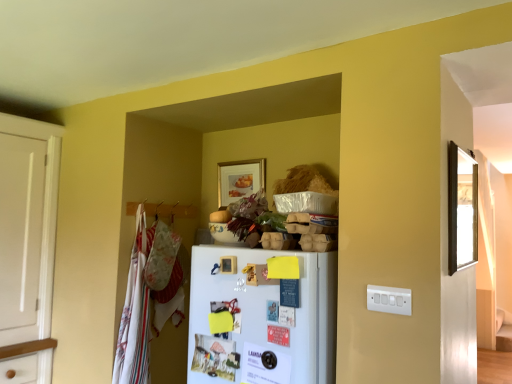
Question: From a real-world perspective, is white matte refrigerator at center physically above white cotton laundry at left?

Choices:
 (A) no
 (B) yes

Answer: (A)

Question: Would you say white matte refrigerator at center is outside white cotton laundry at left?

Choices:
 (A) yes
 (B) no

Answer: (A)

Question: Does white matte refrigerator at center come behind white cotton laundry at left?

Choices:
 (A) yes
 (B) no

Answer: (B)

Question: Can you confirm if white matte refrigerator at center is smaller than white cotton laundry at left?

Choices:
 (A) yes
 (B) no

Answer: (A)

Question: Can you confirm if white matte refrigerator at center is bigger than white cotton laundry at left?

Choices:
 (A) no
 (B) yes

Answer: (A)

Question: From the image's perspective, is white cotton laundry at left above or below wooden mirror at right, placed as the first picture frame when sorted from front to back?

Choices:
 (A) above
 (B) below

Answer: (B)

Question: From a real-world perspective, is white cotton laundry at left above or below wooden mirror at right, the 1th picture frame viewed from the right?

Choices:
 (A) above
 (B) below

Answer: (B)

Question: Is point (123, 367) positioned closer to the camera than point (455, 188)?

Choices:
 (A) farther
 (B) closer

Answer: (A)

Question: Considering their positions, is white cotton laundry at left located in front of or behind wooden mirror at right, the 1th picture frame viewed from the right?

Choices:
 (A) behind
 (B) front

Answer: (A)

Question: In the image, is white plastic switch plate at lower right positioned in front of or behind wooden mirror at right, positioned as the 2th picture frame in left-to-right order?

Choices:
 (A) front
 (B) behind

Answer: (A)

Question: Do you think white plastic switch plate at lower right is within wooden mirror at right, positioned as the 2th picture frame in left-to-right order, or outside of it?

Choices:
 (A) outside
 (B) inside

Answer: (A)

Question: From a real-world perspective, is white plastic switch plate at lower right positioned above or below wooden mirror at right, marked as the 2th picture frame in a back-to-front arrangement?

Choices:
 (A) below
 (B) above

Answer: (A)

Question: Based on their sizes in the image, would you say white plastic switch plate at lower right is bigger or smaller than wooden mirror at right, the 1th picture frame viewed from the right?

Choices:
 (A) small
 (B) big

Answer: (A)

Question: From a real-world perspective, relative to matte wooden picture frame at upper center, the 2th picture frame viewed from the right, is white matte refrigerator at center vertically above or below?

Choices:
 (A) below
 (B) above

Answer: (A)

Question: Is point (238, 377) positioned closer to the camera than point (222, 198)?

Choices:
 (A) closer
 (B) farther

Answer: (A)